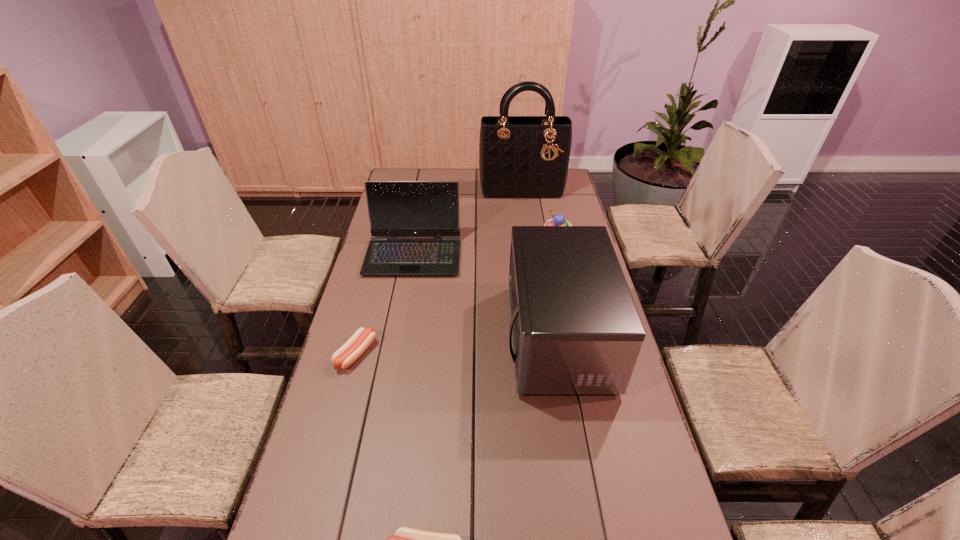
Identify the location of vacant area situated 0.210m on the screen of the laptop computer. (401, 321).

Where is `free space located 0.060m on the left of the third shortest object`? Image resolution: width=960 pixels, height=540 pixels. free space located 0.060m on the left of the third shortest object is located at coordinates (527, 242).

Locate an element on the screen. The height and width of the screenshot is (540, 960). free location located 0.080m on the front of the left sausage is located at coordinates (344, 398).

Find the location of a particular element. This screenshot has width=960, height=540. object that is positioned at the far edge is located at coordinates (524, 157).

Where is `laptop computer at the left edge`? This screenshot has height=540, width=960. laptop computer at the left edge is located at coordinates (396, 209).

In order to click on sausage positioned at the left edge in this screenshot , I will do `click(346, 355)`.

This screenshot has height=540, width=960. I want to click on handbag that is at the right edge, so click(524, 157).

This screenshot has height=540, width=960. I want to click on microwave oven located in the right edge section of the desktop, so (x=576, y=330).

The height and width of the screenshot is (540, 960). What are the coordinates of `icecream situated at the right edge` in the screenshot? It's located at (558, 220).

This screenshot has width=960, height=540. What are the coordinates of `object that is positioned at the far right corner` in the screenshot? It's located at (524, 157).